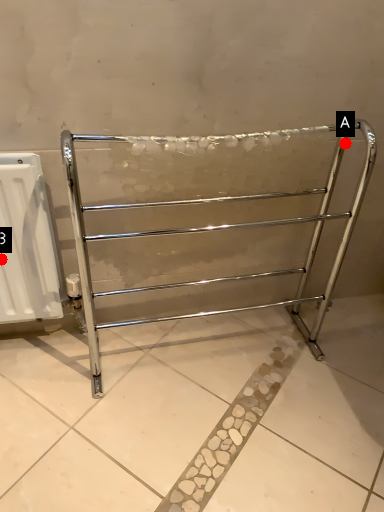
Question: Two points are circled on the image, labeled by A and B beside each circle. Which point appears closest to the camera in this image?

Choices:
 (A) A is closer
 (B) B is closer

Answer: (B)